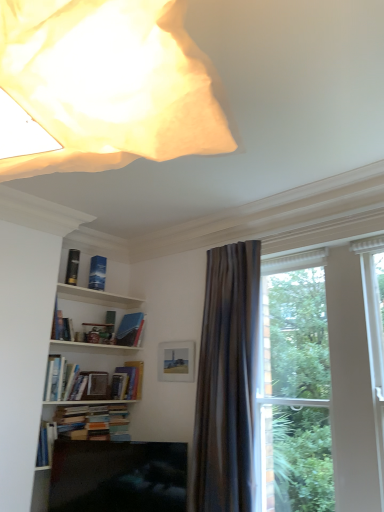
This screenshot has width=384, height=512. I want to click on hardcover books at lower left, marked as the 1th book in a bottom-to-top arrangement, so click(x=93, y=422).

The height and width of the screenshot is (512, 384). Describe the element at coordinates (96, 297) in the screenshot. I see `white wooden shelf at upper left` at that location.

What is the approximate height of white wooden shelf at upper left?

white wooden shelf at upper left is 1.88 inches in height.

The height and width of the screenshot is (512, 384). Describe the element at coordinates (176, 361) in the screenshot. I see `matte white picture frame at center` at that location.

In order to face matte white picture frame at center, should I rotate leftwards or rightwards?

You should look left and rotate roughly 2.010 degrees.

What do you see at coordinates (72, 267) in the screenshot? I see `metallic gold bookshelf at upper left, positioned as the fifth book in bottom-to-top order` at bounding box center [72, 267].

Where is `silky gray curtain at right`? silky gray curtain at right is located at coordinates tap(227, 381).

From the image's perspective, which object appears higher, blue matte bookshelf at upper left, positioned as the 2th book in top-to-bottom order, or matte white picture frame at center?

From the image's view, blue matte bookshelf at upper left, positioned as the 2th book in top-to-bottom order, is above.

In terms of width, does blue matte bookshelf at upper left, which is the fourth book in bottom-to-top order, look wider or thinner when compared to matte white picture frame at center?

In the image, blue matte bookshelf at upper left, which is the fourth book in bottom-to-top order, appears to be wider than matte white picture frame at center.

Would you say blue matte bookshelf at upper left, which is the fourth book in bottom-to-top order, is outside matte white picture frame at center?

Yes.

What's the angular difference between hardcover books at lower left, marked as the 1th book in a bottom-to-top arrangement, and silky gray curtain at right's facing directions?

The angular difference between hardcover books at lower left, marked as the 1th book in a bottom-to-top arrangement, and silky gray curtain at right is 93.7 degrees.

The width and height of the screenshot is (384, 512). In order to click on the 3rd book to the left of the silky gray curtain at right, starting your count from the anchor in this screenshot , I will do `click(93, 422)`.

From a real-world perspective, is hardcover books at lower left, marked as the 1th book in a bottom-to-top arrangement, over silky gray curtain at right?

No, from a real-world perspective, hardcover books at lower left, marked as the 1th book in a bottom-to-top arrangement, is not on top of silky gray curtain at right.

Is hardcover books at lower left, marked as the 1th book in a bottom-to-top arrangement, oriented towards silky gray curtain at right?

Yes, hardcover books at lower left, marked as the 1th book in a bottom-to-top arrangement, is aimed at silky gray curtain at right.

Considering the relative sizes of hardcover book at center, which appears as the second book when ordered from the bottom, and blue matte book at upper center, the 3th book in the bottom-to-top sequence, in the image provided, is hardcover book at center, which appears as the second book when ordered from the bottom, taller than blue matte book at upper center, the 3th book in the bottom-to-top sequence,?

No, hardcover book at center, which appears as the second book when ordered from the bottom, is not taller than blue matte book at upper center, the 3th book in the bottom-to-top sequence.

From the picture: From the image's perspective, is hardcover book at center, which appears as the second book when ordered from the bottom, below blue matte book at upper center, the 3th book in the bottom-to-top sequence?

Yes, from the image's perspective, hardcover book at center, which appears as the second book when ordered from the bottom, is beneath blue matte book at upper center, the 3th book in the bottom-to-top sequence.

Who is bigger, hardcover book at center, the 4th book viewed from the top, or blue matte book at upper center, the 3th book in the bottom-to-top sequence?

With larger size is blue matte book at upper center, the 3th book in the bottom-to-top sequence.

In the image, is hardcover books at lower left, positioned as the 5th book in top-to-bottom order, positioned in front of or behind blue matte book at upper center, which is the 3th book in top-to-bottom order?

hardcover books at lower left, positioned as the 5th book in top-to-bottom order, is positioned closer to the viewer than blue matte book at upper center, which is the 3th book in top-to-bottom order.

Which is nearer, [101,424] or [129,333]?

Clearly, point [101,424] is closer to the camera than point [129,333].

In terms of width, does hardcover books at lower left, marked as the 1th book in a bottom-to-top arrangement, look wider or thinner when compared to blue matte book at upper center, which is the 3th book in top-to-bottom order?

Considering their sizes, hardcover books at lower left, marked as the 1th book in a bottom-to-top arrangement, looks slimmer than blue matte book at upper center, which is the 3th book in top-to-bottom order.

Where is `the 3rd book behind the hardcover books at lower left, marked as the 1th book in a bottom-to-top arrangement, starting your count from the anchor`? the 3rd book behind the hardcover books at lower left, marked as the 1th book in a bottom-to-top arrangement, starting your count from the anchor is located at coordinates (130, 329).

Is point (129, 471) closer to viewer compared to point (70, 275)?

Yes, point (129, 471) is in front of point (70, 275).

Considering the positions of objects matte black tv at lower center and metallic gold bookshelf at upper left, positioned as the fifth book in bottom-to-top order, in the image provided, who is behind, matte black tv at lower center or metallic gold bookshelf at upper left, positioned as the fifth book in bottom-to-top order,?

metallic gold bookshelf at upper left, positioned as the fifth book in bottom-to-top order, is further from the camera.

Is matte black tv at lower center not inside metallic gold bookshelf at upper left, positioned as the fifth book in bottom-to-top order?

Yes.

Considering the sizes of objects matte black tv at lower center and metallic gold bookshelf at upper left, which is counted as the 1th book, starting from the top, in the image provided, who is smaller, matte black tv at lower center or metallic gold bookshelf at upper left, which is counted as the 1th book, starting from the top,?

metallic gold bookshelf at upper left, which is counted as the 1th book, starting from the top, is smaller.

Between blue matte bookshelf at upper left, positioned as the 2th book in top-to-bottom order, and white wooden shelf at upper left, which one has smaller size?

Smaller between the two is blue matte bookshelf at upper left, positioned as the 2th book in top-to-bottom order.

Which object is wider, blue matte bookshelf at upper left, positioned as the 2th book in top-to-bottom order, or white wooden shelf at upper left?

With larger width is white wooden shelf at upper left.

Is point (101, 268) more distant than point (124, 300)?

That is False.

In terms of height, does blue matte bookshelf at upper left, which is the fourth book in bottom-to-top order, look taller or shorter compared to white wooden shelf at upper left?

blue matte bookshelf at upper left, which is the fourth book in bottom-to-top order, is taller than white wooden shelf at upper left.

Are matte white picture frame at center and hardcover book at center, which appears as the second book when ordered from the bottom, far apart?

Actually, matte white picture frame at center and hardcover book at center, which appears as the second book when ordered from the bottom, are a little close together.

Which object is closer to the camera taking this photo, matte white picture frame at center or hardcover book at center, the 4th book viewed from the top?

Positioned in front is matte white picture frame at center.

Does matte white picture frame at center contain hardcover book at center, the 4th book viewed from the top?

No, matte white picture frame at center does not contain hardcover book at center, the 4th book viewed from the top.

What's the angular difference between matte white picture frame at center and hardcover book at center, which appears as the second book when ordered from the bottom,'s facing directions?

86.4 degrees.

Locate an element on the screen. The width and height of the screenshot is (384, 512). picture frame on the right of the blue matte bookshelf at upper left, which is the fourth book in bottom-to-top order is located at coordinates (176, 361).

Where is `curtain in front of the hardcover books at lower left, marked as the 1th book in a bottom-to-top arrangement`? curtain in front of the hardcover books at lower left, marked as the 1th book in a bottom-to-top arrangement is located at coordinates (227, 381).

From the image, which object appears to be nearer to hardcover book at center, the 4th book viewed from the top, white wooden shelf at upper left or metallic gold bookshelf at upper left, positioned as the fifth book in bottom-to-top order?

Among the two, white wooden shelf at upper left is located nearer to hardcover book at center, the 4th book viewed from the top.

From the image, which object appears to be farther from matte white picture frame at center, blue matte book at upper center, the 3th book in the bottom-to-top sequence, or blue matte bookshelf at upper left, which is the fourth book in bottom-to-top order?

The object further to matte white picture frame at center is blue matte bookshelf at upper left, which is the fourth book in bottom-to-top order.

Based on their spatial positions, is metallic gold bookshelf at upper left, positioned as the fifth book in bottom-to-top order, or white wooden shelf at upper left further from blue matte bookshelf at upper left, positioned as the 2th book in top-to-bottom order?

The object further to blue matte bookshelf at upper left, positioned as the 2th book in top-to-bottom order, is white wooden shelf at upper left.

Estimate the real-world distances between objects in this image. Which object is closer to hardcover books at lower left, positioned as the 5th book in top-to-bottom order, metallic gold bookshelf at upper left, which is counted as the 1th book, starting from the top, or blue matte bookshelf at upper left, which is the fourth book in bottom-to-top order?

blue matte bookshelf at upper left, which is the fourth book in bottom-to-top order.

Based on their spatial positions, is silky gray curtain at right or blue matte bookshelf at upper left, which is the fourth book in bottom-to-top order, further from metallic gold bookshelf at upper left, which is counted as the 1th book, starting from the top?

Based on the image, silky gray curtain at right appears to be further to metallic gold bookshelf at upper left, which is counted as the 1th book, starting from the top.

Based on their spatial positions, is blue matte bookshelf at upper left, positioned as the 2th book in top-to-bottom order, or matte white picture frame at center further from white wooden shelf at upper left?

matte white picture frame at center is positioned further to the anchor white wooden shelf at upper left.

Considering their positions, is white wooden shelf at upper left positioned further to clear glass window at right than hardcover books at lower left, positioned as the 5th book in top-to-bottom order?

white wooden shelf at upper left.

Estimate the real-world distances between objects in this image. Which object is further from blue matte bookshelf at upper left, positioned as the 2th book in top-to-bottom order, matte white picture frame at center or silky gray curtain at right?

silky gray curtain at right.

Identify the location of cabinet between metallic gold bookshelf at upper left, positioned as the fifth book in bottom-to-top order, and hardcover book at center, which appears as the second book when ordered from the bottom, vertically. Image resolution: width=384 pixels, height=512 pixels. (96, 297).

This screenshot has height=512, width=384. Identify the location of cabinet between blue matte bookshelf at upper left, which is the fourth book in bottom-to-top order, and clear glass window at right from left to right. (96, 297).

The height and width of the screenshot is (512, 384). Find the location of `picture frame between metallic gold bookshelf at upper left, positioned as the fifth book in bottom-to-top order, and clear glass window at right from left to right`. picture frame between metallic gold bookshelf at upper left, positioned as the fifth book in bottom-to-top order, and clear glass window at right from left to right is located at coordinates (176, 361).

Image resolution: width=384 pixels, height=512 pixels. I want to click on book located between hardcover book at center, which appears as the second book when ordered from the bottom, and matte white picture frame at center in the left-right direction, so click(x=130, y=329).